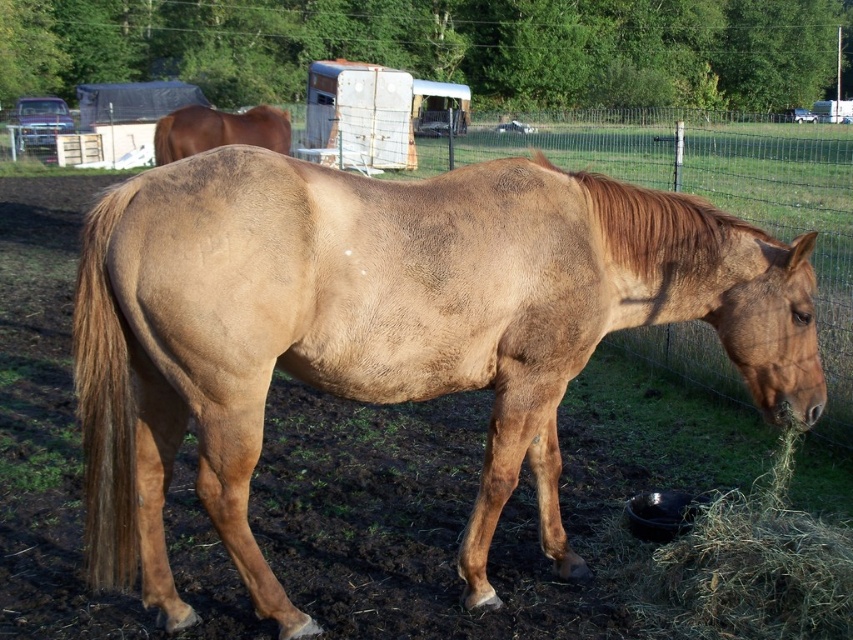
You are a farmer checking the pasture. You see the green straw at lower right and the brown matte horse at upper left. Which object is positioned lower in the image?

The green straw at lower right is located below the brown matte horse at upper left, so it is positioned lower in the image.

You are a farmer checking the pasture. You notice the brown matte horse at center and the green straw at lower right. Can you determine if there is enough space between them for a 1 meter wide tractor to pass through?

The brown matte horse at center and green straw at lower right are 88.64 centimeters apart, which is less than 1 meter. Therefore, the tractor cannot pass through the space between them.